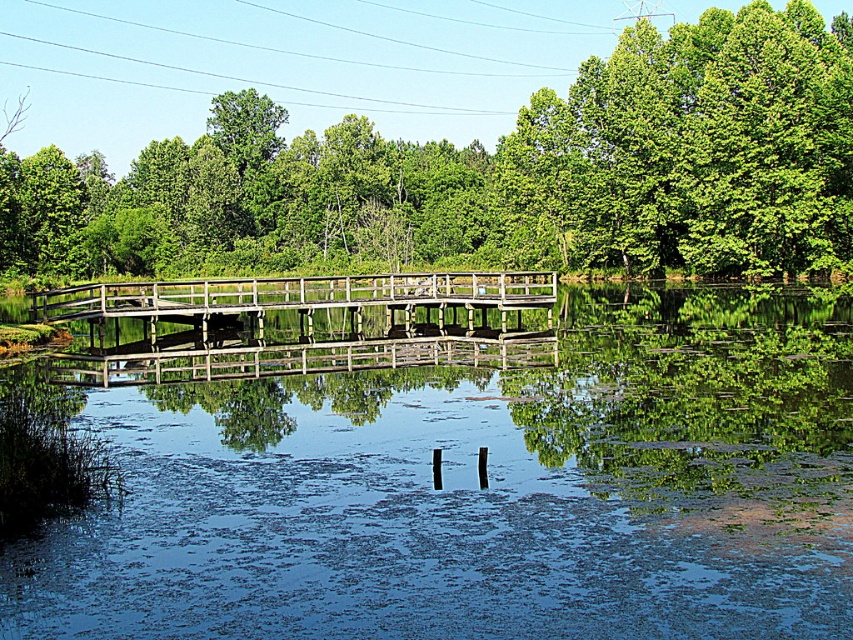
You are standing on the wooden bridge and want to take a photo of both the clear water at center and the green leafy tree at center. Which object should you position to your left side in the camera frame to capture both?

To capture both the clear water at center and the green leafy tree at center in your photo, you should position the green leafy tree at center to your left side in the camera frame since the clear water at center is located to the right of the green leafy tree at center.

You are standing on the wooden bridge and looking towards the water. There are two points marked on the bridge. The first point is at coordinate point (x=833, y=305) and the second point is at coordinate point (x=422, y=280). Which point is closer to your eyes?

Point (x=422, y=280) is closer to your eyes because it is nearer to the camera compared to point (x=833, y=305), which is further away.